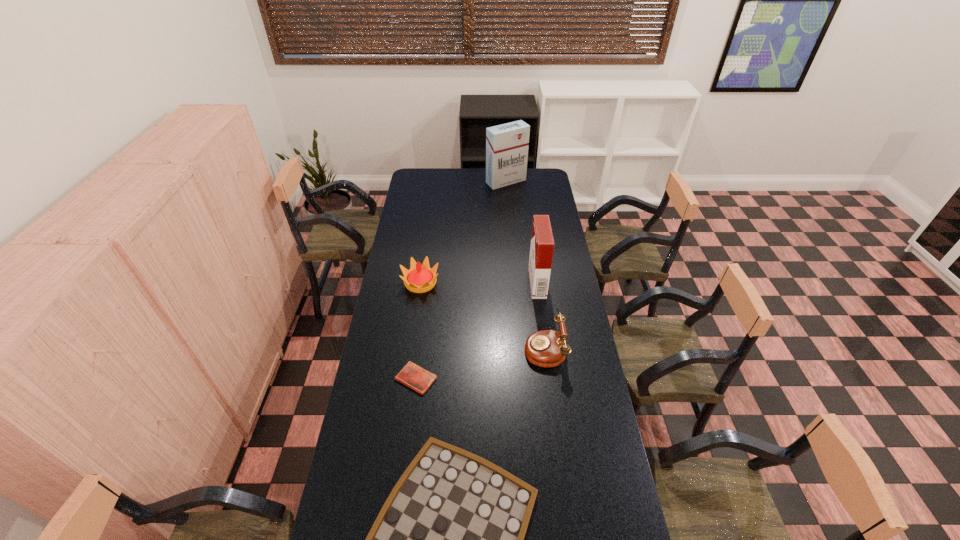
Image resolution: width=960 pixels, height=540 pixels. In order to click on vacant space at the left edge of the desktop in this screenshot , I will do `click(421, 199)`.

This screenshot has height=540, width=960. I want to click on vacant space at the right edge, so click(563, 291).

At what (x,y) coordinates should I click in order to perform the action: click on free spot at the far left corner of the desktop. Please return your answer as a coordinate pair (x, y). The height and width of the screenshot is (540, 960). Looking at the image, I should click on (433, 174).

I want to click on free point between the telephone and the farther cigarette_case, so click(x=525, y=265).

At what (x,y) coordinates should I click in order to perform the action: click on free space that is in between the shortest object and the farthest object. Please return your answer as a coordinate pair (x, y). This screenshot has width=960, height=540. Looking at the image, I should click on point(461,280).

Find the location of a particular element. The image size is (960, 540). vacant region between the nearer cigarette_case and the shortest object is located at coordinates (477, 331).

At what (x,y) coordinates should I click in order to perform the action: click on vacant space that is in between the diary and the farther cigarette_case. Please return your answer as a coordinate pair (x, y). The image size is (960, 540). Looking at the image, I should click on (461, 280).

Image resolution: width=960 pixels, height=540 pixels. What are the coordinates of `empty space between the telephone and the nearer cigarette_case` in the screenshot? It's located at (540, 315).

At what (x,y) coordinates should I click in order to perform the action: click on unoccupied area between the farther cigarette_case and the crown. Please return your answer as a coordinate pair (x, y). This screenshot has height=540, width=960. Looking at the image, I should click on (464, 232).

Point out which object is positioned as the second nearest to the crown. Please provide its 2D coordinates. Your answer should be formatted as a tuple, i.e. [(x, y)], where the tuple contains the x and y coordinates of a point satisfying the conditions above.

[(547, 348)]